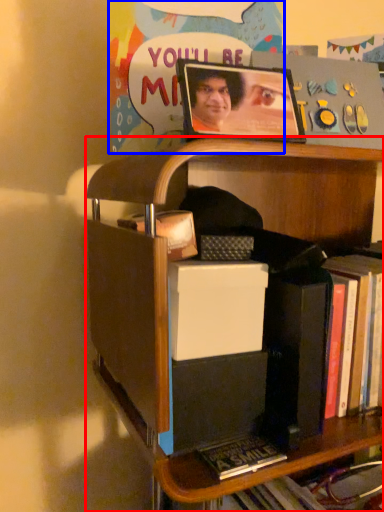
Question: Which point is further to the camera, shelf (highlighted by a red box) or postcard (highlighted by a blue box)?

Choices:
 (A) shelf
 (B) postcard

Answer: (B)